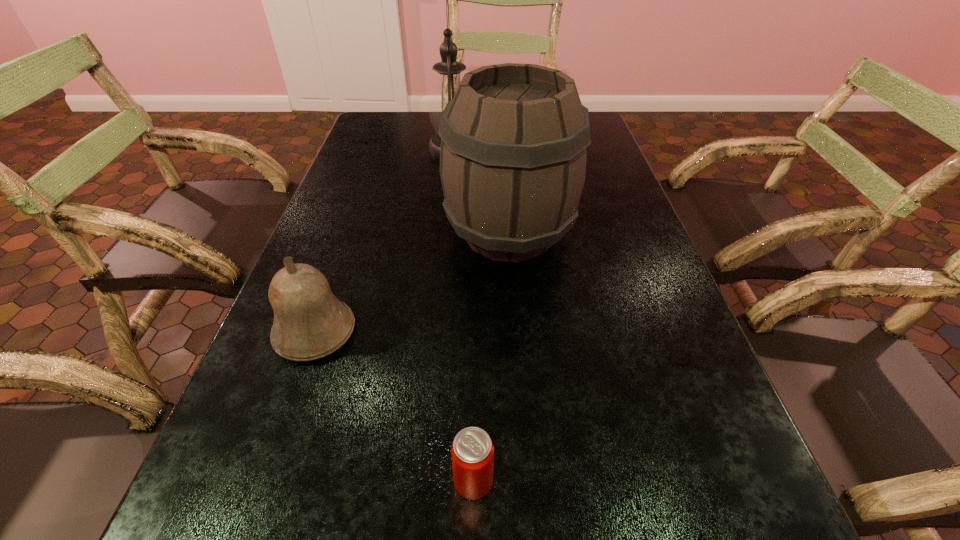
Identify the location of free spot located 0.230m on the left of the nearest object. The height and width of the screenshot is (540, 960). (295, 481).

At what (x,y) coordinates should I click in order to perform the action: click on object located at the far edge. Please return your answer as a coordinate pair (x, y). Looking at the image, I should click on (449, 70).

Where is `object that is at the left edge`? object that is at the left edge is located at coordinates (309, 323).

Find the location of `free space at the far edge`. free space at the far edge is located at coordinates (425, 120).

Where is `vacant space at the left edge of the desktop`? The image size is (960, 540). vacant space at the left edge of the desktop is located at coordinates (339, 194).

This screenshot has width=960, height=540. In order to click on free space at the right edge of the desktop in this screenshot , I will do `click(685, 505)`.

The image size is (960, 540). In the image, there is a desktop. Find the location of `vacant space at the far left corner`. vacant space at the far left corner is located at coordinates (366, 141).

You are a GUI agent. You are given a task and a screenshot of the screen. Output one action in this format:
    pyautogui.click(x=<x>, y=<y>)
    Task: Click on the free point between the farthest object and the can
    
    Given the screenshot: What is the action you would take?
    pyautogui.click(x=463, y=314)

Identify the location of free space between the third farthest object and the oil lamp. The image size is (960, 540). (384, 240).

This screenshot has height=540, width=960. I want to click on free point between the second shortest object and the can, so click(395, 406).